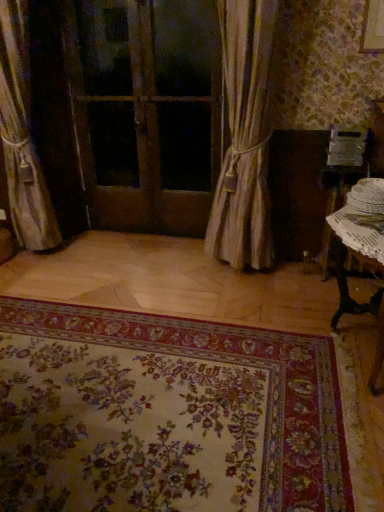
Question: Considering the positions of white lace table at right, which appears as the first table when viewed from the back, and white wicker table at lower right, which appears as the first table when viewed from the front, in the image, is white lace table at right, which appears as the first table when viewed from the back, bigger or smaller than white wicker table at lower right, which appears as the first table when viewed from the front,?

Choices:
 (A) small
 (B) big

Answer: (A)

Question: From the image's perspective, is white lace table at right, which appears as the first table when viewed from the back, positioned above or below white wicker table at lower right, the second table from the back?

Choices:
 (A) above
 (B) below

Answer: (A)

Question: Which object is positioned farthest from the floral carpet at lower center?

Choices:
 (A) wooden door at center
 (B) white lace table at right, arranged as the 2th table when viewed from the front
 (C) silky beige curtain at center, which is the first curtain from right to left
 (D) white wicker table at lower right, which appears as the first table when viewed from the front
 (E) silky beige curtain at left, which ranks as the 1th curtain in left-to-right order

Answer: (A)

Question: Which object is the closest to the white lace table at right, arranged as the 2th table when viewed from the front?

Choices:
 (A) wooden door at center
 (B) white wicker table at lower right, which appears as the first table when viewed from the front
 (C) silky beige curtain at center, positioned as the 2th curtain in left-to-right order
 (D) silky beige curtain at left, which appears as the second curtain when viewed from the right
 (E) floral carpet at lower center

Answer: (C)